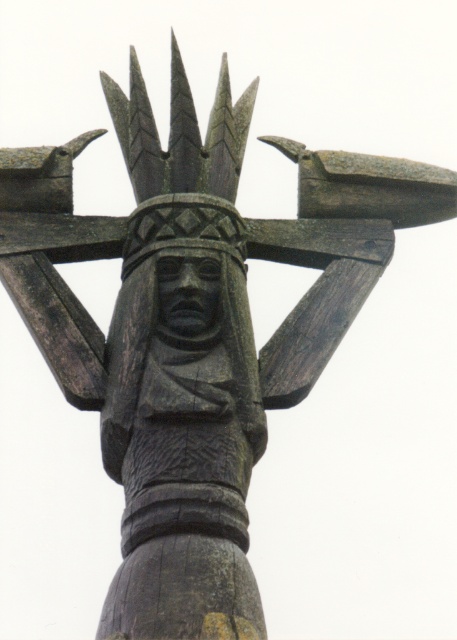
Who is more distant from viewer, (173,196) or (190,308)?

Point (173,196)

Is carved wood head at center below dark wood carving at center?

No, carved wood head at center is not below dark wood carving at center.

In the scene shown: Who is more forward, (148,204) or (181,339)?

Point (181,339) is more forward.

The width and height of the screenshot is (457, 640). I want to click on carved wood head at center, so click(182, 227).